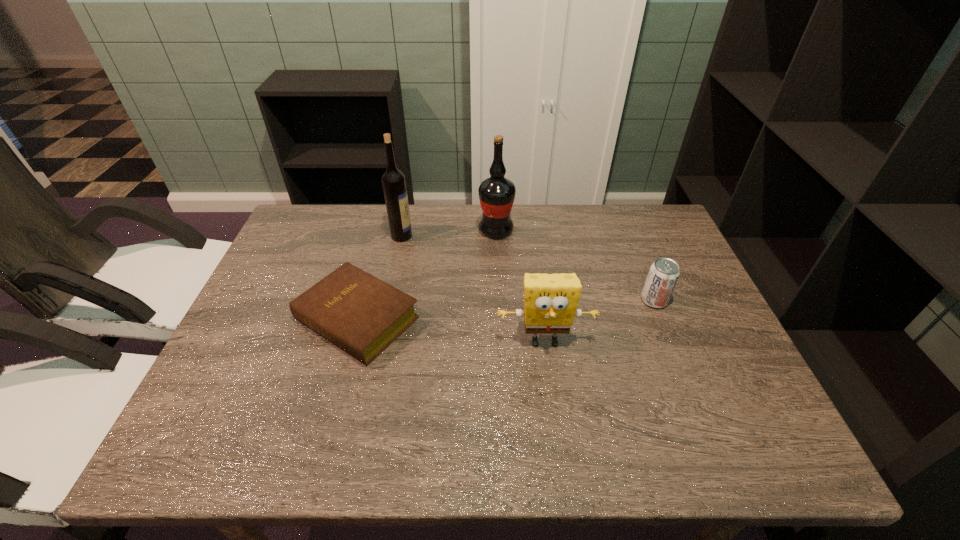
The width and height of the screenshot is (960, 540). Find the location of `the left wine bottle`. the left wine bottle is located at coordinates (393, 180).

The image size is (960, 540). Find the location of `the right wine bottle`. the right wine bottle is located at coordinates (496, 194).

Find the location of a particular element. The width and height of the screenshot is (960, 540). the third tallest object is located at coordinates (550, 300).

Locate an element on the screen. The height and width of the screenshot is (540, 960). soda can is located at coordinates (663, 275).

At what (x,y) coordinates should I click in order to perform the action: click on the fourth tallest object. Please return your answer as a coordinate pair (x, y). Image resolution: width=960 pixels, height=540 pixels. Looking at the image, I should click on (663, 275).

The image size is (960, 540). Find the location of `the shortest object`. the shortest object is located at coordinates (362, 315).

Locate an element on the screen. The height and width of the screenshot is (540, 960). vacant space located on the label of the left wine bottle is located at coordinates (484, 235).

Locate an element on the screen. free location located on the front of the right wine bottle is located at coordinates (500, 320).

At what (x,y) coordinates should I click in order to perform the action: click on free region located 0.170m on the face of the sponge. Please return your answer as a coordinate pair (x, y). The image size is (960, 540). Looking at the image, I should click on (556, 425).

I want to click on vacant region located on the left of the soda can, so click(618, 300).